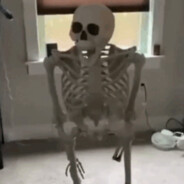
Mark all positions containing where you plug in applicances in the image. Your answer should be formatted as a list of tuples, i.e. [(x1, y1), (x2, y2), ...], where each tuple contains the x and y coordinates of a point satisfying the conditions above.

[(141, 84)]